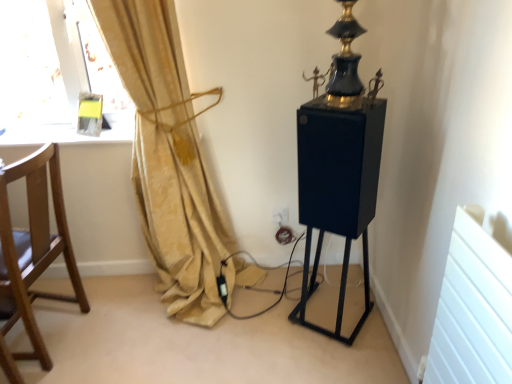
Locate an element on the screen. This screenshot has height=384, width=512. gold fabric curtain at left is located at coordinates (168, 157).

Identify the location of wooden chair at left. The image size is (512, 384). (32, 254).

The width and height of the screenshot is (512, 384). What do you see at coordinates (69, 131) in the screenshot? I see `matte glass window sill at upper left` at bounding box center [69, 131].

At what (x,y) coordinates should I click in order to perform the action: click on gold fabric curtain at left. Please return your answer as a coordinate pair (x, y). Looking at the image, I should click on (168, 157).

From the picture: Between white plastic electric outlet at center and wooden chair at left, which one has more height?

Standing taller between the two is wooden chair at left.

Is white plastic electric outlet at center far away from wooden chair at left?

white plastic electric outlet at center is positioned a significant distance from wooden chair at left.

How many degrees apart are the facing directions of white plastic electric outlet at center and wooden chair at left?

95.3 degrees separate the facing orientations of white plastic electric outlet at center and wooden chair at left.

Can we say white plastic electric outlet at center lies outside wooden chair at left?

Indeed, white plastic electric outlet at center is completely outside wooden chair at left.

Which is less distant, (7, 258) or (123, 140)?

Point (7, 258) is positioned closer to the camera compared to point (123, 140).

You are a GUI agent. You are given a task and a screenshot of the screen. Output one action in this format:
    pyautogui.click(x=<x>, y=<y>)
    Task: Click on the chair in front of the matte glass window sill at upper left
    The height and width of the screenshot is (384, 512).
    Given the screenshot: What is the action you would take?
    pyautogui.click(x=32, y=254)

Is wooden chair at left looking in the opposite direction of matte glass window sill at upper left?

No, wooden chair at left's orientation is not away from matte glass window sill at upper left.

The image size is (512, 384). I want to click on electric outlet below the gold fabric curtain at left (from the image's perspective), so click(x=281, y=216).

Is white plastic electric outlet at center to the right of gold fabric curtain at left from the viewer's perspective?

Indeed, white plastic electric outlet at center is positioned on the right side of gold fabric curtain at left.

How many degrees apart are the facing directions of matte glass window sill at upper left and gold fabric curtain at left?

The facing directions of matte glass window sill at upper left and gold fabric curtain at left are 0.839 degrees apart.

Is matte glass window sill at upper left with gold fabric curtain at left?

matte glass window sill at upper left and gold fabric curtain at left are not in contact.

From a real-world perspective, is matte glass window sill at upper left beneath gold fabric curtain at left?

No, from a real-world perspective, matte glass window sill at upper left is not under gold fabric curtain at left.

From their relative heights in the image, would you say matte glass window sill at upper left is taller or shorter than gold fabric curtain at left?

matte glass window sill at upper left is shorter than gold fabric curtain at left.

Who is smaller, wooden chair at left or gold fabric curtain at left?

wooden chair at left is smaller.

From the image's perspective, is wooden chair at left above or below gold fabric curtain at left?

Based on their image positions, wooden chair at left is located beneath gold fabric curtain at left.

Is point (55, 175) positioned behind point (151, 197)?

No, (55, 175) is in front of (151, 197).

Who is smaller, gold fabric curtain at left or matte glass window sill at upper left?

Smaller between the two is matte glass window sill at upper left.

From their relative heights in the image, would you say gold fabric curtain at left is taller or shorter than matte glass window sill at upper left?

Clearly, gold fabric curtain at left is taller compared to matte glass window sill at upper left.

How much distance is there between gold fabric curtain at left and matte glass window sill at upper left?

They are 17.84 inches apart.

Are gold fabric curtain at left and matte glass window sill at upper left making contact?

No, gold fabric curtain at left is not touching matte glass window sill at upper left.

Looking at the image, does white plastic electric outlet at center seem bigger or smaller compared to matte glass window sill at upper left?

In the image, white plastic electric outlet at center appears to be smaller than matte glass window sill at upper left.

The height and width of the screenshot is (384, 512). In order to click on window sill above the white plastic electric outlet at center (from the image's perspective) in this screenshot , I will do `click(69, 131)`.

Considering their positions, is white plastic electric outlet at center located in front of or behind matte glass window sill at upper left?

Visually, white plastic electric outlet at center is located behind matte glass window sill at upper left.

Does white plastic electric outlet at center have a lesser height compared to matte glass window sill at upper left?

No.

Locate an element on the screen. electric outlet that appears behind the wooden chair at left is located at coordinates (281, 216).

What are the coordinates of `chair directly beneath the matte glass window sill at upper left (from a real-world perspective)` in the screenshot? It's located at (32, 254).

Looking at the image, which one is located closer to wooden chair at left, matte glass window sill at upper left or white plastic electric outlet at center?

Among the two, matte glass window sill at upper left is located nearer to wooden chair at left.

Which object lies nearer to the anchor point wooden chair at left, gold fabric curtain at left or white plastic electric outlet at center?

gold fabric curtain at left is closer to wooden chair at left.

Based on the photo, estimate the real-world distances between objects in this image. Which object is closer to gold fabric curtain at left, matte glass window sill at upper left or white plastic electric outlet at center?

matte glass window sill at upper left.

Which object lies nearer to the anchor point white plastic electric outlet at center, gold fabric curtain at left or matte glass window sill at upper left?

gold fabric curtain at left lies closer to white plastic electric outlet at center than the other object.

Considering their positions, is matte glass window sill at upper left positioned closer to gold fabric curtain at left than wooden chair at left?

The object closer to gold fabric curtain at left is matte glass window sill at upper left.

When comparing their distances from white plastic electric outlet at center, does matte glass window sill at upper left or wooden chair at left seem closer?

matte glass window sill at upper left.

Which object lies nearer to the anchor point white plastic electric outlet at center, matte glass window sill at upper left or gold fabric curtain at left?

Based on the image, gold fabric curtain at left appears to be nearer to white plastic electric outlet at center.

Which object lies further to the anchor point wooden chair at left, gold fabric curtain at left or matte glass window sill at upper left?

matte glass window sill at upper left.

The height and width of the screenshot is (384, 512). I want to click on curtain between matte glass window sill at upper left and white plastic electric outlet at center from left to right, so click(168, 157).

Where is `chair positioned between gold fabric curtain at left and matte glass window sill at upper left from near to far`? chair positioned between gold fabric curtain at left and matte glass window sill at upper left from near to far is located at coordinates (32, 254).

Identify the location of curtain between wooden chair at left and white plastic electric outlet at center in the horizontal direction. This screenshot has height=384, width=512. (168, 157).

In order to click on window sill between wooden chair at left and white plastic electric outlet at center in this screenshot , I will do `click(69, 131)`.